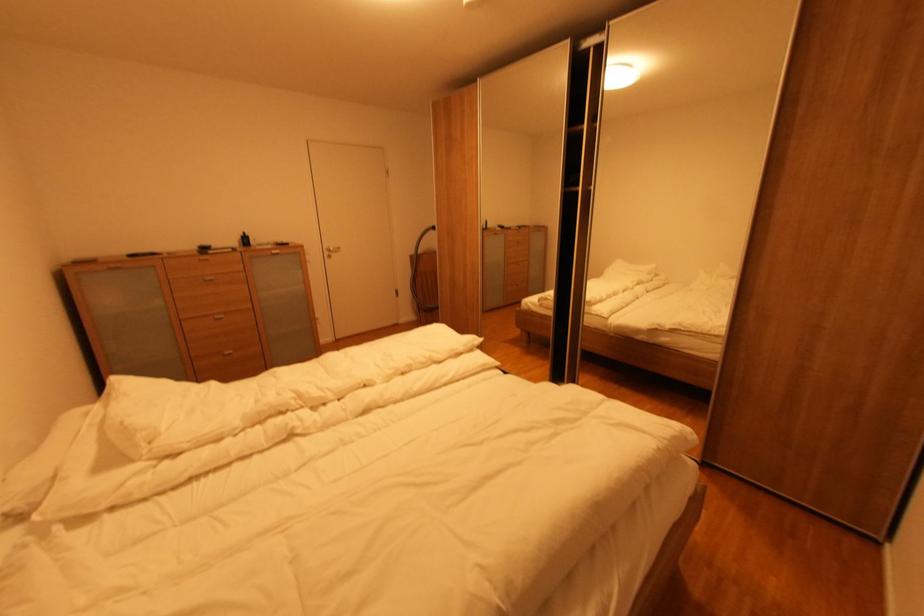
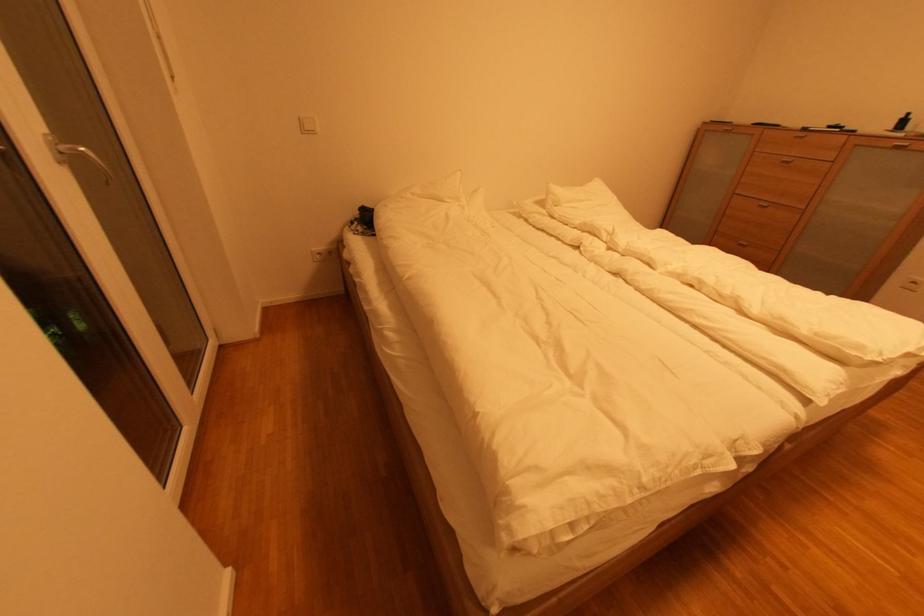
Where in the second image is the point corresponding to pixel 237 354 from the first image?

(749, 246)